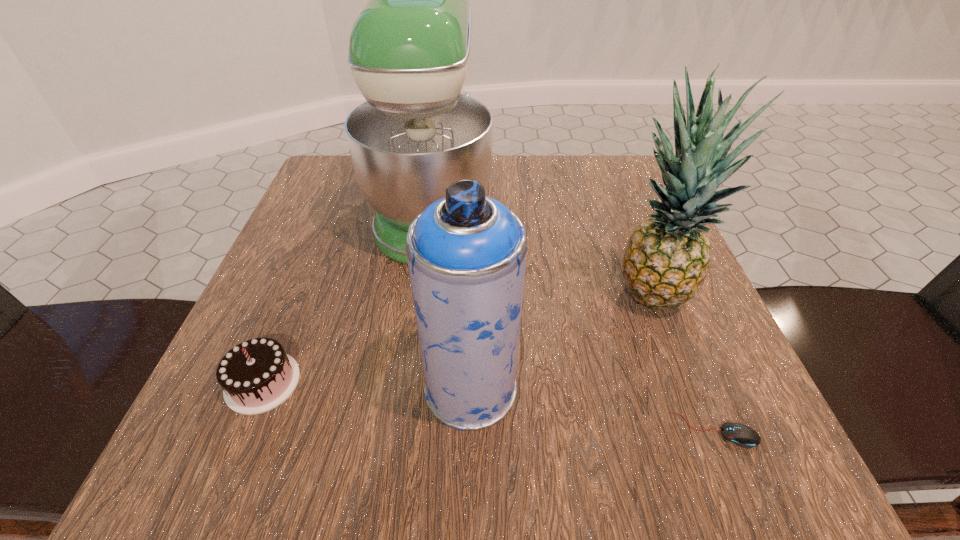
Locate an element on the screen. free space located 0.300m on the left of the shortest object is located at coordinates (443, 430).

In order to click on object present at the far edge in this screenshot , I will do `click(419, 131)`.

You are a GUI agent. You are given a task and a screenshot of the screen. Output one action in this format:
    pyautogui.click(x=<x>, y=<y>)
    Task: Click on the aerosol can at the near edge
    The image size is (960, 540).
    Given the screenshot: What is the action you would take?
    pyautogui.click(x=466, y=253)

Identify the location of mouse that is at the near edge. Image resolution: width=960 pixels, height=540 pixels. (742, 435).

I want to click on mixer present at the left edge, so click(x=419, y=131).

Locate an element on the screen. The image size is (960, 540). chocolate cake located in the left edge section of the desktop is located at coordinates (257, 375).

Where is `pineapple at the right edge`? The height and width of the screenshot is (540, 960). pineapple at the right edge is located at coordinates (667, 257).

I want to click on mouse at the right edge, so click(742, 435).

This screenshot has width=960, height=540. I want to click on object that is at the far left corner, so click(419, 131).

At what (x,y) coordinates should I click in order to perform the action: click on object that is at the near right corner. Please return your answer as a coordinate pair (x, y). This screenshot has height=540, width=960. Looking at the image, I should click on (742, 435).